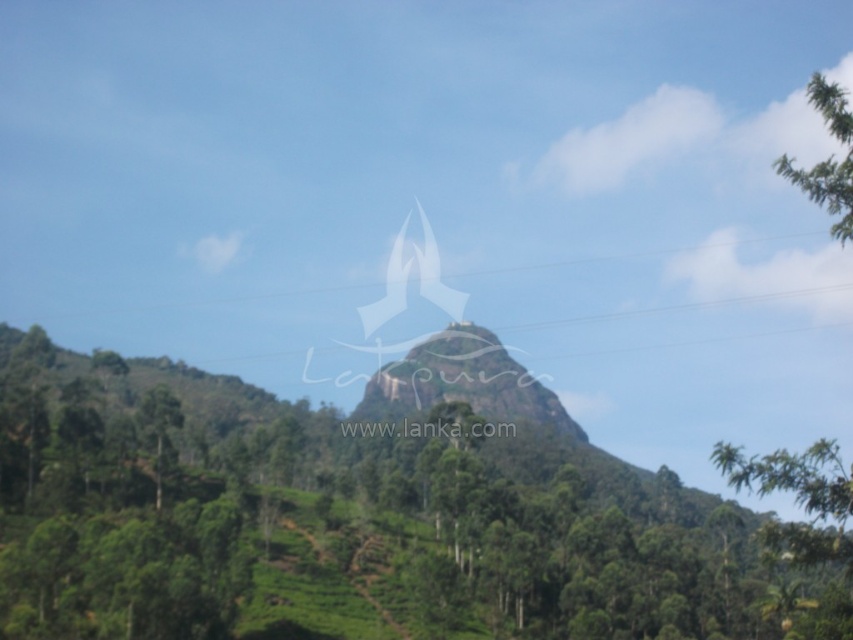
You are a hiker who wants to take a photo of both the green leafy tree at center and the green leafy tree at upper right in the scenic landscape. Which tree should you stand closer to in order to capture both in a single frame?

You should stand closer to the green leafy tree at upper right because it is smaller in size compared to the green leafy tree at center. By positioning yourself nearer to the smaller tree, both trees will appear more balanced in the frame, allowing you to include both within the camera view.

You are a hiker planning to take a photo of the green leafy tree at center and the green leafy tree at upper right. Based on their sizes, which tree would appear larger in your photo?

The green leafy tree at center might appear larger in the photo because it is wider than the green leafy tree at upper right.